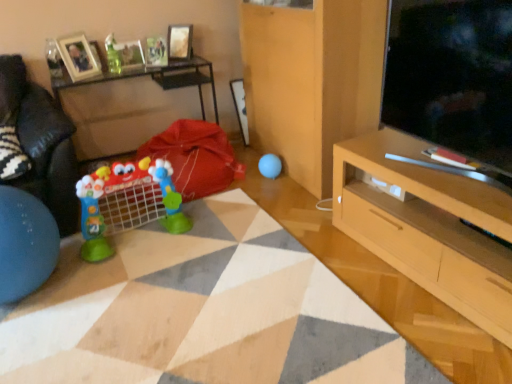
Question: Can you confirm if matte glass picture frame at upper left, the second picture frame in the right-to-left sequence, is taller than metallic silver picture frame at upper center, which appears as the 1th picture frame when viewed from the right?

Choices:
 (A) yes
 (B) no

Answer: (A)

Question: From a real-world perspective, is matte glass picture frame at upper left, the second picture frame in the right-to-left sequence, under metallic silver picture frame at upper center, marked as the 3th picture frame in a left-to-right arrangement?

Choices:
 (A) no
 (B) yes

Answer: (A)

Question: Considering the relative sizes of matte glass picture frame at upper left, the second picture frame in the right-to-left sequence, and metallic silver picture frame at upper center, marked as the 3th picture frame in a left-to-right arrangement, in the image provided, is matte glass picture frame at upper left, the second picture frame in the right-to-left sequence, shorter than metallic silver picture frame at upper center, marked as the 3th picture frame in a left-to-right arrangement,?

Choices:
 (A) yes
 (B) no

Answer: (B)

Question: Would you say matte glass picture frame at upper left, the second picture frame in the right-to-left sequence, contains metallic silver picture frame at upper center, marked as the 3th picture frame in a left-to-right arrangement?

Choices:
 (A) yes
 (B) no

Answer: (B)

Question: Is matte glass picture frame at upper left, the second picture frame in the right-to-left sequence, at the left side of metallic silver picture frame at upper center, marked as the 3th picture frame in a left-to-right arrangement?

Choices:
 (A) yes
 (B) no

Answer: (A)

Question: Considering the relative positions of plastic toy at center, arranged as the 1th toy when viewed from the front, and blue rubber ball at center, the third toy positioned from the left, in the image provided, is plastic toy at center, arranged as the 1th toy when viewed from the front, to the left or to the right of blue rubber ball at center, the third toy positioned from the left,?

Choices:
 (A) right
 (B) left

Answer: (B)

Question: Is plastic toy at center, the third toy in the top-to-bottom sequence, spatially inside blue rubber ball at center, the first toy from the right, or outside of it?

Choices:
 (A) inside
 (B) outside

Answer: (B)

Question: Considering the positions of plastic toy at center, arranged as the 1th toy when viewed from the front, and blue rubber ball at center, the first toy from the right, in the image, is plastic toy at center, arranged as the 1th toy when viewed from the front, wider or thinner than blue rubber ball at center, the first toy from the right,?

Choices:
 (A) thin
 (B) wide

Answer: (B)

Question: In terms of size, does plastic toy at center, the first toy when ordered from bottom to top, appear bigger or smaller than blue rubber ball at center, the third toy positioned from the left?

Choices:
 (A) small
 (B) big

Answer: (B)

Question: Would you say wooden table at left is to the left or to the right of wooden photo frame at upper left, arranged as the third picture frame when viewed from the right, in the picture?

Choices:
 (A) left
 (B) right

Answer: (B)

Question: From the image's perspective, is wooden table at left positioned above or below wooden photo frame at upper left, the first picture frame positioned from the left?

Choices:
 (A) below
 (B) above

Answer: (A)

Question: Considering the positions of wooden table at left and wooden photo frame at upper left, arranged as the third picture frame when viewed from the right, in the image, is wooden table at left wider or thinner than wooden photo frame at upper left, arranged as the third picture frame when viewed from the right,?

Choices:
 (A) wide
 (B) thin

Answer: (A)

Question: From a real-world perspective, is wooden table at left above or below wooden photo frame at upper left, arranged as the third picture frame when viewed from the right?

Choices:
 (A) below
 (B) above

Answer: (A)

Question: From a real-world perspective, relative to matte glass picture frame at upper left, the second picture frame in the right-to-left sequence, is wooden table at left vertically above or below?

Choices:
 (A) below
 (B) above

Answer: (A)

Question: Considering their positions, is wooden table at left located in front of or behind matte glass picture frame at upper left, positioned as the 2th picture frame in left-to-right order?

Choices:
 (A) front
 (B) behind

Answer: (A)